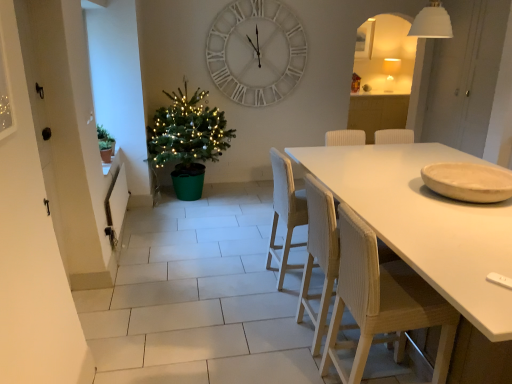
Find the location of `white matte table at center`. white matte table at center is located at coordinates (433, 240).

At what (x,y) coordinates should I click in order to perform the action: click on wooden chair at lower right, arranged as the 3th chair when viewed from the back. Please return your answer as a coordinate pair (x, y). The width and height of the screenshot is (512, 384). Looking at the image, I should click on (382, 303).

You are a GUI agent. You are given a task and a screenshot of the screen. Output one action in this format:
    pyautogui.click(x=<x>, y=<y>)
    Task: Click on the wooden chair at center, acting as the 2th chair starting from the front
    This screenshot has width=512, height=384.
    Given the screenshot: What is the action you would take?
    pyautogui.click(x=320, y=255)

Is white matte table at center positioned with its back to wooden chair at lower right, the 1th chair positioned from the front?

Correct, white matte table at center is looking away from wooden chair at lower right, the 1th chair positioned from the front.

Who is taller, white matte table at center or wooden chair at lower right, the 1th chair positioned from the front?

With more height is wooden chair at lower right, the 1th chair positioned from the front.

From the image's perspective, is white matte table at center positioned above or below wooden chair at lower right, arranged as the 3th chair when viewed from the back?

white matte table at center is situated higher than wooden chair at lower right, arranged as the 3th chair when viewed from the back, in the image.

Between point (472, 241) and point (222, 73), which one is positioned in front?

The point (472, 241) is closer to the camera.

From the image's perspective, would you say white matte table at center is shown under white matte wall clock at upper center?

Yes.

From a real-world perspective, is white matte table at center above or below white matte wall clock at upper center?

white matte table at center is below white matte wall clock at upper center.

Is there a large distance between white matte table at center and white matte wall clock at upper center?

Yes, white matte table at center and white matte wall clock at upper center are located far from each other.

Can you tell me how much wooden chair at center, positioned as the second chair in back-to-front order, and wooden chair at lower right, arranged as the 3th chair when viewed from the back, differ in facing direction?

They differ by 0.00131 degrees in their facing directions.

Would you say wooden chair at center, acting as the 2th chair starting from the front, is outside wooden chair at lower right, the 1th chair positioned from the front?

Indeed, wooden chair at center, acting as the 2th chair starting from the front, is completely outside wooden chair at lower right, the 1th chair positioned from the front.

Between wooden chair at center, acting as the 2th chair starting from the front, and wooden chair at lower right, arranged as the 3th chair when viewed from the back, which one is positioned in front?

wooden chair at lower right, arranged as the 3th chair when viewed from the back.

From the image's perspective, which is above, wooden chair at center, acting as the 2th chair starting from the front, or wooden chair at lower right, the 1th chair positioned from the front?

From the image's view, wooden chair at center, acting as the 2th chair starting from the front, is above.

Between matte white lampshade at upper right and green plastic christmas tree at left, which one appears on the right side from the viewer's perspective?

Positioned to the right is matte white lampshade at upper right.

Based on the photo, are matte white lampshade at upper right and green plastic christmas tree at left beside each other?

matte white lampshade at upper right is not next to green plastic christmas tree at left, and they're not touching.

Can green plastic christmas tree at left be found inside matte white lampshade at upper right?

No, green plastic christmas tree at left is located outside of matte white lampshade at upper right.

Considering the sizes of matte white lampshade at upper right and green plastic christmas tree at left in the image, is matte white lampshade at upper right taller or shorter than green plastic christmas tree at left?

matte white lampshade at upper right is shorter than green plastic christmas tree at left.

Can we say white woven chair at center, positioned as the 3th chair in front-to-back order, lies outside white matte wall clock at upper center?

Indeed, white woven chair at center, positioned as the 3th chair in front-to-back order, is completely outside white matte wall clock at upper center.

How different are the orientations of white woven chair at center, marked as the 1th chair in a back-to-front arrangement, and white matte wall clock at upper center in degrees?

They differ by 92.4 degrees in their facing directions.

Considering the relative positions of white woven chair at center, positioned as the 3th chair in front-to-back order, and white matte wall clock at upper center in the image provided, is white woven chair at center, positioned as the 3th chair in front-to-back order, to the left of white matte wall clock at upper center from the viewer's perspective?

No, white woven chair at center, positioned as the 3th chair in front-to-back order, is not to the left of white matte wall clock at upper center.

Is white woven chair at center, positioned as the 3th chair in front-to-back order, turned away from white matte wall clock at upper center?

No.

From a real-world perspective, is white matte table at center over matte white lampshade at upper right?

No, from a real-world perspective, white matte table at center is not above matte white lampshade at upper right.

Is white matte table at center in front of matte white lampshade at upper right?

Yes.

Would you say white matte table at center is outside matte white lampshade at upper right?

Indeed, white matte table at center is completely outside matte white lampshade at upper right.

Can you tell me how much white matte table at center and matte white lampshade at upper right differ in facing direction?

white matte table at center and matte white lampshade at upper right are facing 90.2 degrees away from each other.

Is beige matte plate at right positioned far away from white woven chair at center, positioned as the 3th chair in front-to-back order?

No, beige matte plate at right is not far from white woven chair at center, positioned as the 3th chair in front-to-back order.

Does beige matte plate at right have a larger size compared to white woven chair at center, positioned as the 3th chair in front-to-back order?

Actually, beige matte plate at right might be smaller than white woven chair at center, positioned as the 3th chair in front-to-back order.

The height and width of the screenshot is (384, 512). Find the location of `the 1st chair to the left of the white matte table at center, counting from the anchor's position`. the 1st chair to the left of the white matte table at center, counting from the anchor's position is located at coordinates (382, 303).

In order to click on table below the white matte wall clock at upper center (from the image's perspective) in this screenshot , I will do `click(433, 240)`.

When comparing their distances from wooden chair at lower right, arranged as the 3th chair when viewed from the back, does matte white lampshade at upper right or green plastic christmas tree at left seem further?

matte white lampshade at upper right lies further to wooden chair at lower right, arranged as the 3th chair when viewed from the back, than the other object.

Looking at the image, which one is located closer to green matte plant at left, matte white lampshade at upper right or wooden chair at lower right, arranged as the 3th chair when viewed from the back?

wooden chair at lower right, arranged as the 3th chair when viewed from the back, is closer to green matte plant at left.

Looking at the image, which one is located closer to green matte plant at left, beige matte plate at right or green plastic christmas tree at left?

green plastic christmas tree at left lies closer to green matte plant at left than the other object.

Which object lies further to the anchor point wooden chair at lower right, the 1th chair positioned from the front, matte white lampshade at upper right or white matte table at center?

Based on the image, matte white lampshade at upper right appears to be further to wooden chair at lower right, the 1th chair positioned from the front.

Consider the image. Which object lies nearer to the anchor point wooden chair at center, acting as the 2th chair starting from the front, white woven chair at center, positioned as the 3th chair in front-to-back order, or matte white lampshade at upper right?

white woven chair at center, positioned as the 3th chair in front-to-back order, lies closer to wooden chair at center, acting as the 2th chair starting from the front, than the other object.

Looking at the image, which one is located closer to wooden chair at lower right, arranged as the 3th chair when viewed from the back, white matte wall clock at upper center or green matte plant at left?

green matte plant at left is closer to wooden chair at lower right, arranged as the 3th chair when viewed from the back.

Looking at the image, which one is located closer to white matte table at center, white matte wall clock at upper center or beige matte plate at right?

The object closer to white matte table at center is beige matte plate at right.

From the image, which object appears to be nearer to white matte wall clock at upper center, matte white lampshade at upper right or white woven chair at center, positioned as the 3th chair in front-to-back order?

matte white lampshade at upper right.

Find the location of a particular element. wall clock situated between green matte plant at left and matte white lampshade at upper right from left to right is located at coordinates (256, 51).

This screenshot has width=512, height=384. What are the coordinates of `houseplant located between wooden chair at lower right, the 1th chair positioned from the front, and matte white lampshade at upper right in the depth direction` in the screenshot? It's located at (105, 144).

The height and width of the screenshot is (384, 512). Find the location of `chair between green matte plant at left and wooden chair at center, positioned as the second chair in back-to-front order`. chair between green matte plant at left and wooden chair at center, positioned as the second chair in back-to-front order is located at coordinates (285, 212).

The image size is (512, 384). Find the location of `houseplant between white matte table at center and white matte wall clock at upper center along the z-axis`. houseplant between white matte table at center and white matte wall clock at upper center along the z-axis is located at coordinates (105, 144).